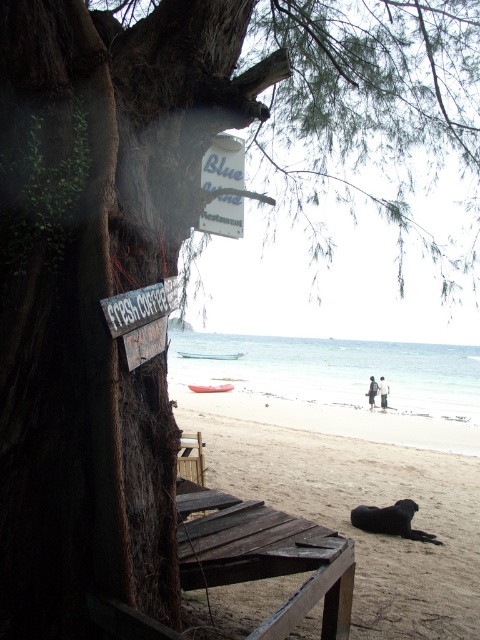
Is brown sandy beach at lower center shorter than weathered wood chair at lower center?

In fact, brown sandy beach at lower center may be taller than weathered wood chair at lower center.

Who is lower down, brown sandy beach at lower center or weathered wood chair at lower center?

Positioned lower is brown sandy beach at lower center.

You are a GUI agent. You are given a task and a screenshot of the screen. Output one action in this format:
    pyautogui.click(x=<x>, y=<y>)
    Task: Click on the brown sandy beach at lower center
    This screenshot has width=480, height=640.
    Given the screenshot: What is the action you would take?
    pyautogui.click(x=369, y=502)

Locate an element on the screen. brown sandy beach at lower center is located at coordinates (369, 502).

Who is taller, brown sandy beach at lower center or white paper sign at upper center?

brown sandy beach at lower center is taller.

Can you confirm if brown sandy beach at lower center is thinner than white paper sign at upper center?

No.

Where is `brown sandy beach at lower center`? The height and width of the screenshot is (640, 480). brown sandy beach at lower center is located at coordinates (369, 502).

Where is `brown sandy beach at lower center`? Image resolution: width=480 pixels, height=640 pixels. brown sandy beach at lower center is located at coordinates (369, 502).

Based on the photo, can you confirm if weathered wood chair at lower center is taller than white paper sign at upper center?

In fact, weathered wood chair at lower center may be shorter than white paper sign at upper center.

Does point (253, 566) come in front of point (240, 184)?

Yes, it is.

This screenshot has width=480, height=640. Identify the location of weathered wood chair at lower center. (264, 556).